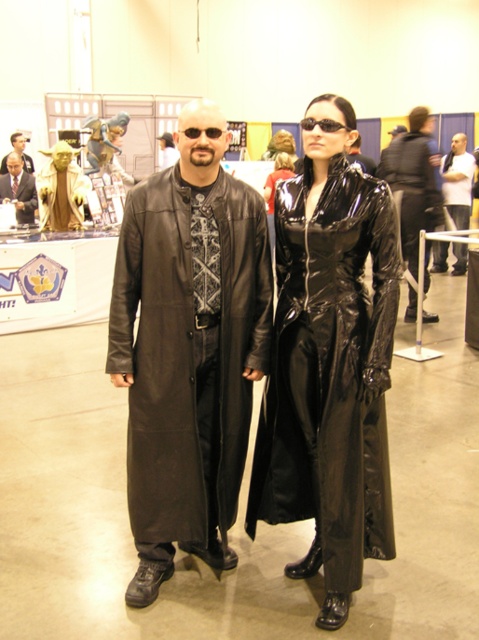
You are a costume designer trying to decide which coat to choose for a character. You have two options in front of you at the convention. The black leather coat at center and the matte black coat at center. Which coat has a larger size?

The matte black coat at center is larger than the black leather coat at center.

You are an event organizer at the convention and need to adjust the display. Since both the shiny black trench coat at center and the matte black suit at center are on the same display stand, which one is closer to the floor?

The shiny black trench coat at center is positioned under the matte black suit at center, so it is closer to the floor.

You are at a convention and want to take a photo of both the glossy black suit at center and the matte black suit at center. Since you can only focus on one at a time, which one should you aim your camera at first to ensure it appears in the left side of the photo?

You should aim your camera at the matte black suit at center first because the glossy black suit at center is to the right of it, so the matte black suit at center will be on the left side of the photo.